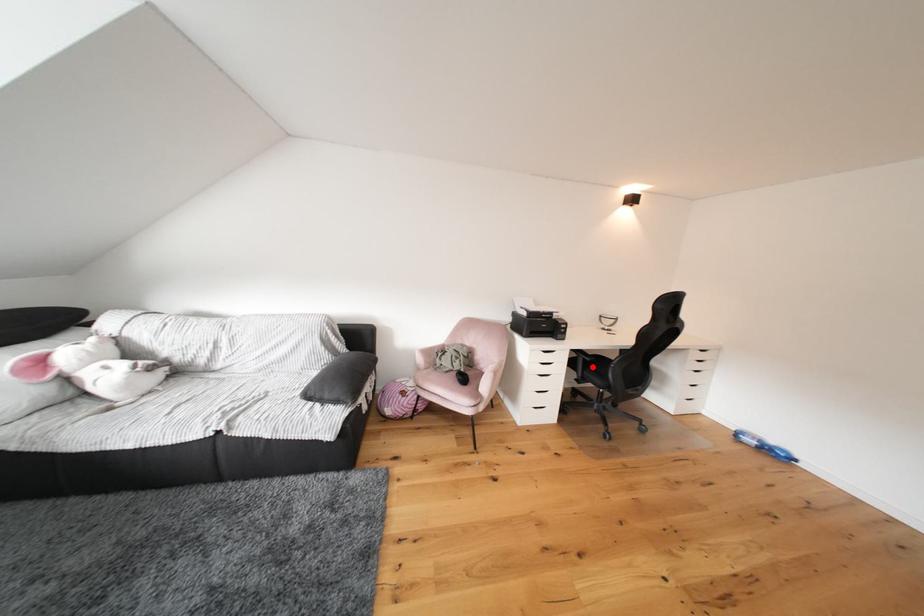
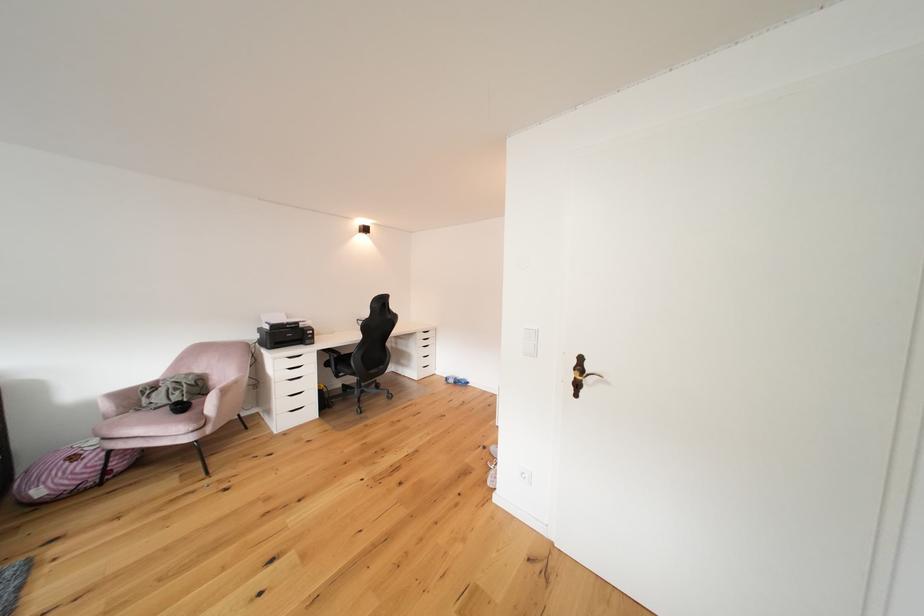
Locate, in the second image, the point that corresponds to the highlighted location in the first image.

(343, 363)